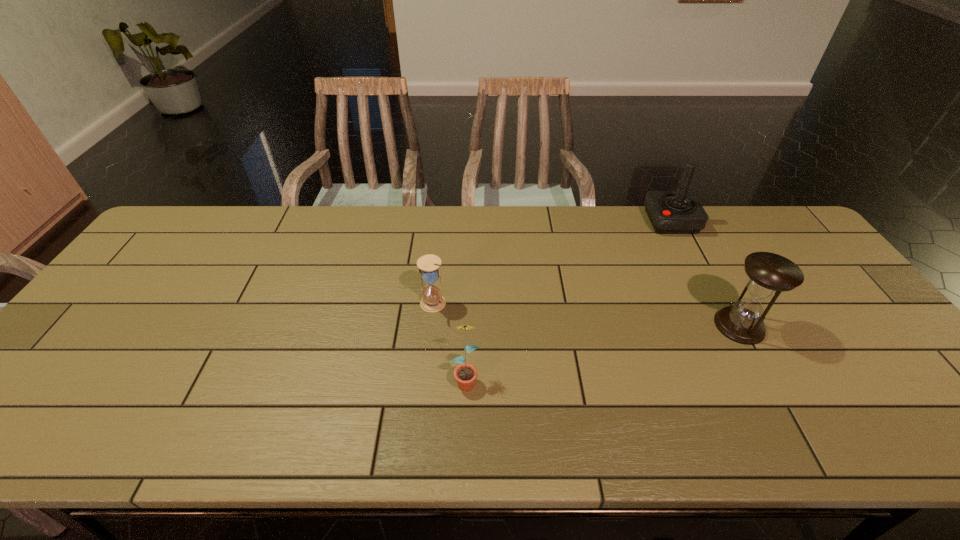
This screenshot has width=960, height=540. In order to click on joystick in this screenshot , I will do `click(670, 212)`.

This screenshot has width=960, height=540. I want to click on the taller hourglass, so click(769, 274).

I want to click on the second object from left to right, so click(x=465, y=374).

This screenshot has height=540, width=960. What are the coordinates of `the nearest object` in the screenshot? It's located at (465, 374).

Image resolution: width=960 pixels, height=540 pixels. I want to click on the leftmost object, so click(x=429, y=265).

In order to click on the left hourglass in this screenshot , I will do `click(429, 265)`.

Identify the location of vacant space situated on the front-facing side of the farthest object. This screenshot has width=960, height=540. (528, 221).

At what (x,y) coordinates should I click in order to perform the action: click on vacant space located 0.280m on the front-facing side of the farthest object. Please return your answer as a coordinate pair (x, y). Looking at the image, I should click on (564, 221).

You are a GUI agent. You are given a task and a screenshot of the screen. Output one action in this format:
    pyautogui.click(x=<x>, y=<y>)
    Task: Click on the free space located on the front-facing side of the farthest object
    
    Given the screenshot: What is the action you would take?
    pyautogui.click(x=606, y=221)

The height and width of the screenshot is (540, 960). Find the location of `free region located 0.050m on the left of the right hourglass`. free region located 0.050m on the left of the right hourglass is located at coordinates (696, 326).